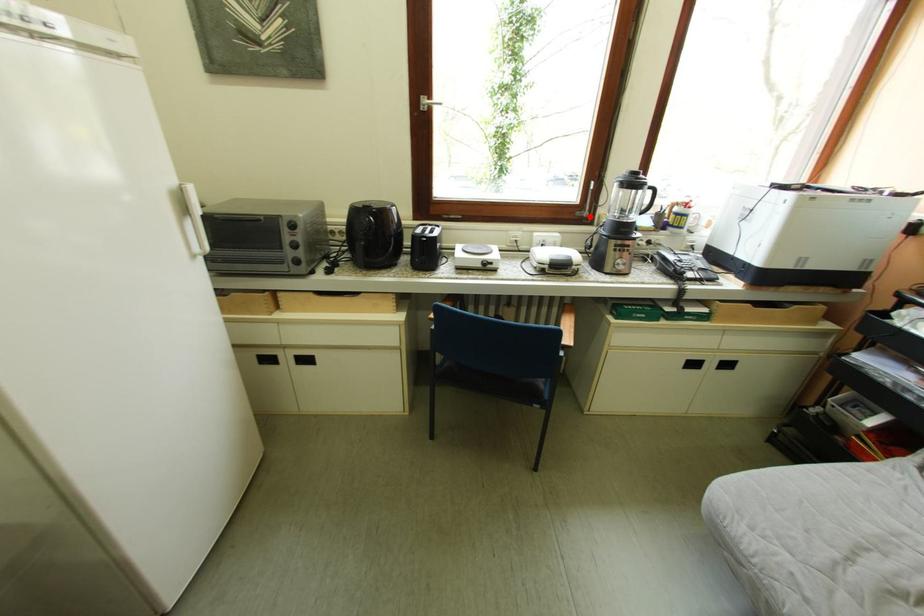
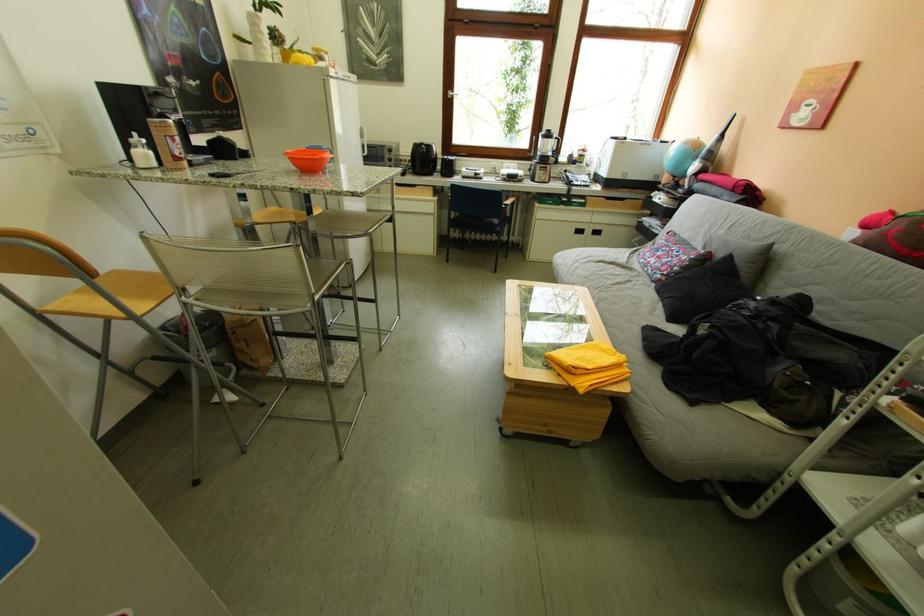
Question: A red point is marked in image1. In image2, is the corresponding 3D point closer to the camera or farther? Reply with the corresponding letter.

Choices:
 (A) The corresponding 3D point is closer.
 (B) The corresponding 3D point is farther.

Answer: (A)